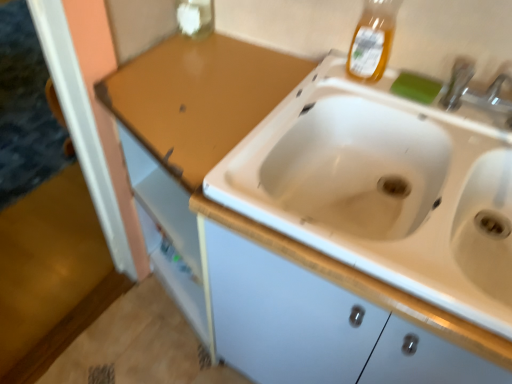
Question: In which direction should I rotate to look at transparent glass bottle at upper center, the 2th bottle in the front-to-back sequence?

Choices:
 (A) left
 (B) right

Answer: (A)

Question: Is translucent amber liquid at upper right, which is counted as the second bottle, starting from the left, oriented away from green sponge at upper right?

Choices:
 (A) yes
 (B) no

Answer: (B)

Question: Can you confirm if translucent amber liquid at upper right, the first bottle from the front, is taller than green sponge at upper right?

Choices:
 (A) no
 (B) yes

Answer: (B)

Question: Is green sponge at upper right inside translucent amber liquid at upper right, acting as the 2th bottle starting from the back?

Choices:
 (A) no
 (B) yes

Answer: (A)

Question: Is translucent amber liquid at upper right, which is counted as the second bottle, starting from the left, positioned behind green sponge at upper right?

Choices:
 (A) no
 (B) yes

Answer: (A)

Question: Is translucent amber liquid at upper right, which is counted as the second bottle, starting from the left, at the left side of green sponge at upper right?

Choices:
 (A) no
 (B) yes

Answer: (B)

Question: Can we say translucent amber liquid at upper right, which is counted as the second bottle, starting from the left, lies outside green sponge at upper right?

Choices:
 (A) yes
 (B) no

Answer: (A)

Question: Is transparent glass bottle at upper center, the 1th bottle from the back, at the right side of green sponge at upper right?

Choices:
 (A) yes
 (B) no

Answer: (B)

Question: From the image's perspective, is transparent glass bottle at upper center, the 2th bottle from the right, over green sponge at upper right?

Choices:
 (A) yes
 (B) no

Answer: (A)

Question: Is transparent glass bottle at upper center, the 2th bottle in the front-to-back sequence, positioned with its back to green sponge at upper right?

Choices:
 (A) yes
 (B) no

Answer: (B)

Question: Considering the relative sizes of transparent glass bottle at upper center, the 2th bottle from the right, and green sponge at upper right in the image provided, is transparent glass bottle at upper center, the 2th bottle from the right, smaller than green sponge at upper right?

Choices:
 (A) yes
 (B) no

Answer: (B)

Question: Is transparent glass bottle at upper center, which is the first bottle in left-to-right order, positioned in front of green sponge at upper right?

Choices:
 (A) no
 (B) yes

Answer: (A)

Question: Is transparent glass bottle at upper center, the 2th bottle in the front-to-back sequence, next to green sponge at upper right and touching it?

Choices:
 (A) yes
 (B) no

Answer: (B)

Question: From the image's perspective, is transparent glass bottle at upper center, the 2th bottle in the front-to-back sequence, over translucent amber liquid at upper right, which is counted as the second bottle, starting from the left?

Choices:
 (A) yes
 (B) no

Answer: (A)